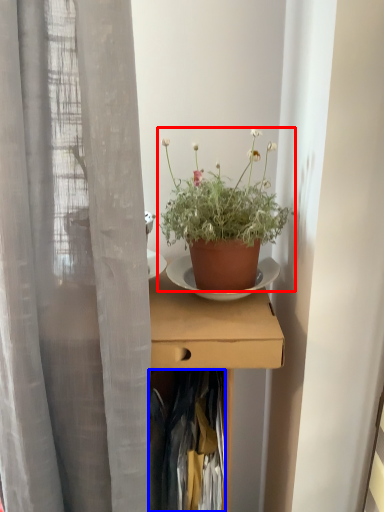
Question: Which point is closer to the camera, houseplant (highlighted by a red box) or clothing (highlighted by a blue box)?

Choices:
 (A) houseplant
 (B) clothing

Answer: (A)